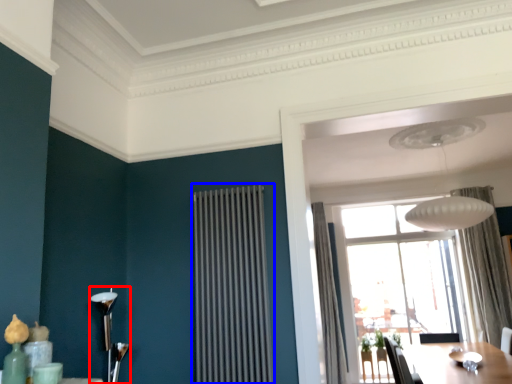
Question: Which point is further to the camera, lamp (highlighted by a red box) or radiator (highlighted by a blue box)?

Choices:
 (A) lamp
 (B) radiator

Answer: (B)